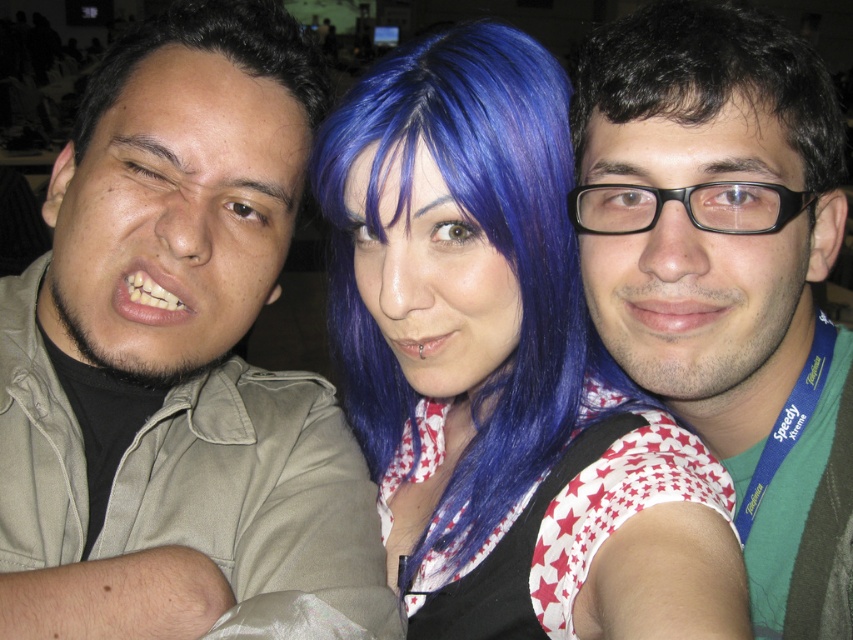
Question: Which object appears farthest from the camera in this image?

Choices:
 (A) dark brown hair at left
 (B) blue hair at center

Answer: (A)

Question: Which object is positioned closest to the black matte glasses at center?

Choices:
 (A) matte khaki shirt at center
 (B) dark brown hair at left
 (C) dark brown shiny hair at center
 (D) blue hair at center

Answer: (C)

Question: Can you confirm if black matte glasses at center is thinner than dark brown hair at left?

Choices:
 (A) no
 (B) yes

Answer: (A)

Question: Can you confirm if dark brown shiny hair at center is positioned to the right of dark brown hair at left?

Choices:
 (A) no
 (B) yes

Answer: (B)

Question: Considering the relative positions of blue hair at center and dark brown shiny hair at center in the image provided, where is blue hair at center located with respect to dark brown shiny hair at center?

Choices:
 (A) right
 (B) left

Answer: (B)

Question: Which object is farther from the camera taking this photo?

Choices:
 (A) black matte glasses at center
 (B) dark brown shiny hair at center
 (C) blue hair at center

Answer: (B)